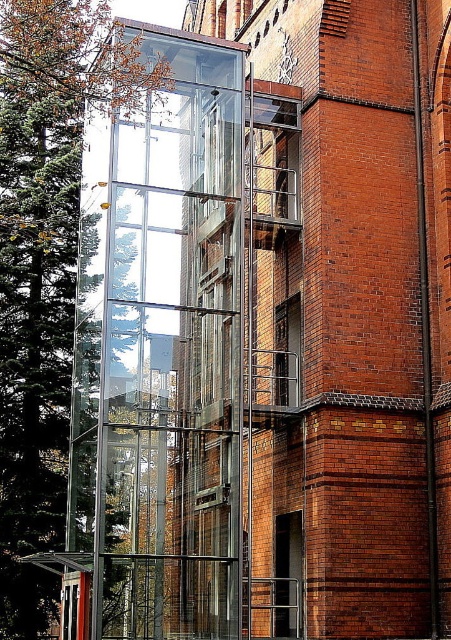
From the picture: Can you confirm if transparent glass elevator at center is thinner than green leafy tree at left?

Indeed, transparent glass elevator at center has a lesser width compared to green leafy tree at left.

Is point (188, 259) closer to viewer compared to point (53, 196)?

Yes, point (188, 259) is in front of point (53, 196).

Where is `transparent glass elevator at center`? transparent glass elevator at center is located at coordinates (174, 356).